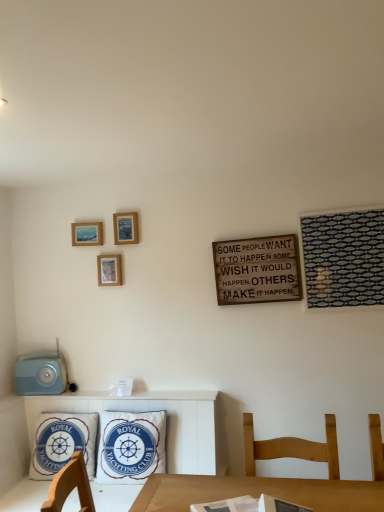
In order to face wooden picture frame at upper center, the third picture frame positioned from the left, should I rotate leftwards or rightwards?

Rotate your view left by about 8.894°.

What do you see at coordinates (63, 443) in the screenshot? The height and width of the screenshot is (512, 384). I see `blue cotton pillow at lower left, acting as the first pillow starting from the left` at bounding box center [63, 443].

Find the location of `wooden picture frame at center-left, acting as the first picture frame starting from the bottom`. wooden picture frame at center-left, acting as the first picture frame starting from the bottom is located at coordinates (109, 270).

The width and height of the screenshot is (384, 512). What do you see at coordinates (257, 270) in the screenshot?
I see `wooden signboard at center-right` at bounding box center [257, 270].

Locate an element on the screen. This screenshot has width=384, height=512. white fabric pillow at center, which ranks as the 2th pillow in left-to-right order is located at coordinates (130, 446).

What do you see at coordinates (87, 234) in the screenshot? The width and height of the screenshot is (384, 512). I see `wooden picture frame at upper left, marked as the 1th picture frame in a left-to-right arrangement` at bounding box center [87, 234].

Identify the location of wooden picture frame at upper center, the 1th picture frame when ordered from top to bottom. The width and height of the screenshot is (384, 512). (126, 228).

Is wooden picture frame at center-left, acting as the first picture frame starting from the bottom, oriented away from wooden signboard at center-right?

wooden picture frame at center-left, acting as the first picture frame starting from the bottom, is not turned away from wooden signboard at center-right.

Can you confirm if wooden picture frame at center-left, the 3th picture frame when ordered from top to bottom, is positioned to the right of wooden signboard at center-right?

No, wooden picture frame at center-left, the 3th picture frame when ordered from top to bottom, is not to the right of wooden signboard at center-right.

Could you measure the distance between wooden picture frame at center-left, the 3th picture frame when ordered from top to bottom, and wooden signboard at center-right?

34.40 inches.

What's the angular difference between wooden picture frame at center-left, which is counted as the second picture frame, starting from the left, and wooden signboard at center-right's facing directions?

0.0638 degrees.

Which object is thinner, wooden picture frame at upper left, marked as the 1th picture frame in a left-to-right arrangement, or wooden signboard at center-right?

With smaller width is wooden signboard at center-right.

How distant is wooden picture frame at upper left, which is the third picture frame in right-to-left order, from wooden signboard at center-right?

wooden picture frame at upper left, which is the third picture frame in right-to-left order, and wooden signboard at center-right are 1.02 meters apart.

From the image's perspective, is wooden picture frame at upper left, arranged as the 2th picture frame when ordered from the bottom, located above or below wooden signboard at center-right?

wooden picture frame at upper left, arranged as the 2th picture frame when ordered from the bottom, is above wooden signboard at center-right.

From the image's perspective, does wooden signboard at center-right appear lower than wooden picture frame at upper left, which is counted as the second picture frame, starting from the top?

Yes, from the image's perspective, wooden signboard at center-right is below wooden picture frame at upper left, which is counted as the second picture frame, starting from the top.

Which is further, [274,247] or [77,227]?

The point [77,227] is behind.

Is wooden signboard at center-right looking in the opposite direction of wooden picture frame at upper left, which is the third picture frame in right-to-left order?

No, wooden signboard at center-right is not facing away from wooden picture frame at upper left, which is the third picture frame in right-to-left order.

Is point (128, 226) closer to camera compared to point (258, 272)?

No, (128, 226) is further to viewer.

Which object is closer to the camera, wooden picture frame at upper center, the 1th picture frame when ordered from top to bottom, or wooden signboard at center-right?

wooden signboard at center-right is closer to the camera.

From a real-world perspective, relative to wooden signboard at center-right, is wooden picture frame at upper center, the 3th picture frame ordered from the bottom, vertically above or below?

Clearly, from a real-world perspective, wooden picture frame at upper center, the 3th picture frame ordered from the bottom, is above wooden signboard at center-right.

Does wooden picture frame at upper center, the 3th picture frame ordered from the bottom, contain wooden signboard at center-right?

No, wooden signboard at center-right is not a part of wooden picture frame at upper center, the 3th picture frame ordered from the bottom.

Is wooden signboard at center-right at the right side of white fabric pillow at center, the 1th pillow in the right-to-left sequence?

Indeed, wooden signboard at center-right is positioned on the right side of white fabric pillow at center, the 1th pillow in the right-to-left sequence.

Between point (223, 259) and point (136, 441), which one is positioned behind?

The point (223, 259) is more distant.

Is wooden signboard at center-right in front of or behind white fabric pillow at center, the 1th pillow in the right-to-left sequence, in the image?

In the image, wooden signboard at center-right appears behind white fabric pillow at center, the 1th pillow in the right-to-left sequence.

Does white fabric pillow at center, the 1th pillow in the right-to-left sequence, appear on the left side of wooden picture frame at upper left, arranged as the 2th picture frame when ordered from the bottom?

No.

From the image's perspective, relative to wooden picture frame at upper left, arranged as the 2th picture frame when ordered from the bottom, is white fabric pillow at center, which ranks as the 2th pillow in left-to-right order, above or below?

Clearly, from the image's perspective, white fabric pillow at center, which ranks as the 2th pillow in left-to-right order, is below wooden picture frame at upper left, arranged as the 2th picture frame when ordered from the bottom.

Considering the sizes of objects white fabric pillow at center, which ranks as the 2th pillow in left-to-right order, and wooden picture frame at upper left, which is counted as the second picture frame, starting from the top, in the image provided, who is bigger, white fabric pillow at center, which ranks as the 2th pillow in left-to-right order, or wooden picture frame at upper left, which is counted as the second picture frame, starting from the top,?

With larger size is white fabric pillow at center, which ranks as the 2th pillow in left-to-right order.

Looking at this image, which of these two, blue cotton pillow at lower left, acting as the first pillow starting from the left, or wooden signboard at center-right, is smaller?

wooden signboard at center-right.

Is blue cotton pillow at lower left, acting as the first pillow starting from the left, looking in the opposite direction of wooden signboard at center-right?

blue cotton pillow at lower left, acting as the first pillow starting from the left, does not have its back to wooden signboard at center-right.

Is blue cotton pillow at lower left, which is the second pillow from right to left, wider than wooden signboard at center-right?

Correct, the width of blue cotton pillow at lower left, which is the second pillow from right to left, exceeds that of wooden signboard at center-right.

What's the angular difference between blue cotton pillow at lower left, which is the second pillow from right to left, and wooden signboard at center-right's facing directions?

2.22 degrees.

This screenshot has width=384, height=512. In order to click on bulletin board located underneath the wooden picture frame at center-left, which is counted as the second picture frame, starting from the left (from a real-world perspective) in this screenshot , I will do `click(257, 270)`.

From a real-world perspective, which picture frame is the 2nd one above the wooden signboard at center-right? Please provide its 2D coordinates.

[(87, 234)]

Looking at the image, which one is located further to wooden picture frame at upper left, marked as the 1th picture frame in a left-to-right arrangement, wooden signboard at center-right or wooden chair at lower right?

Among the two, wooden chair at lower right is located further to wooden picture frame at upper left, marked as the 1th picture frame in a left-to-right arrangement.

Which object lies further to the anchor point wooden picture frame at upper left, which is the third picture frame in right-to-left order, wooden picture frame at upper center, the third picture frame positioned from the left, or wooden picture frame at center-left, the 3th picture frame when ordered from top to bottom?

The object further to wooden picture frame at upper left, which is the third picture frame in right-to-left order, is wooden picture frame at center-left, the 3th picture frame when ordered from top to bottom.

Considering their positions, is wooden picture frame at center-left, marked as the 2th picture frame in a right-to-left arrangement, positioned closer to white fabric pillow at center, the 1th pillow in the right-to-left sequence, than wooden picture frame at upper center, the 3th picture frame ordered from the bottom?

The object closer to white fabric pillow at center, the 1th pillow in the right-to-left sequence, is wooden picture frame at center-left, marked as the 2th picture frame in a right-to-left arrangement.

Estimate the real-world distances between objects in this image. Which object is further from wooden signboard at center-right, wooden picture frame at upper left, marked as the 1th picture frame in a left-to-right arrangement, or wooden picture frame at upper center, the third picture frame positioned from the left?

Based on the image, wooden picture frame at upper left, marked as the 1th picture frame in a left-to-right arrangement, appears to be further to wooden signboard at center-right.

Looking at the image, which one is located further to white fabric pillow at center, the 1th pillow in the right-to-left sequence, wooden picture frame at upper center, the 1th picture frame when ordered from top to bottom, or blue cotton pillow at lower left, acting as the first pillow starting from the left?

wooden picture frame at upper center, the 1th picture frame when ordered from top to bottom, is positioned further to the anchor white fabric pillow at center, the 1th pillow in the right-to-left sequence.

Based on their spatial positions, is white fabric pillow at center, the 1th pillow in the right-to-left sequence, or wooden picture frame at upper left, which is the third picture frame in right-to-left order, further from wooden signboard at center-right?

white fabric pillow at center, the 1th pillow in the right-to-left sequence, is positioned further to the anchor wooden signboard at center-right.

From the image, which object appears to be nearer to wooden chair at lower right, white fabric pillow at center, the 1th pillow in the right-to-left sequence, or blue cotton pillow at lower left, which is the second pillow from right to left?

white fabric pillow at center, the 1th pillow in the right-to-left sequence.

Based on their spatial positions, is wooden picture frame at center-left, the 3th picture frame when ordered from top to bottom, or white fabric pillow at center, the 1th pillow in the right-to-left sequence, further from wooden signboard at center-right?

white fabric pillow at center, the 1th pillow in the right-to-left sequence.

I want to click on picture frame between wooden picture frame at center-left, the 3th picture frame when ordered from top to bottom, and wooden signboard at center-right, so click(126, 228).

Where is `bulletin board between wooden picture frame at upper center, which appears as the first picture frame when viewed from the right, and blue cotton pillow at lower left, which is the second pillow from right to left, from top to bottom`? bulletin board between wooden picture frame at upper center, which appears as the first picture frame when viewed from the right, and blue cotton pillow at lower left, which is the second pillow from right to left, from top to bottom is located at coordinates (257, 270).

Where is `picture frame located between wooden chair at lower right and wooden picture frame at center-left, acting as the first picture frame starting from the bottom, in the depth direction`? picture frame located between wooden chair at lower right and wooden picture frame at center-left, acting as the first picture frame starting from the bottom, in the depth direction is located at coordinates (126, 228).

Where is `pillow between wooden picture frame at center-left, which is counted as the second picture frame, starting from the left, and blue cotton pillow at lower left, which is the second pillow from right to left, from top to bottom`? The height and width of the screenshot is (512, 384). pillow between wooden picture frame at center-left, which is counted as the second picture frame, starting from the left, and blue cotton pillow at lower left, which is the second pillow from right to left, from top to bottom is located at coordinates (130, 446).